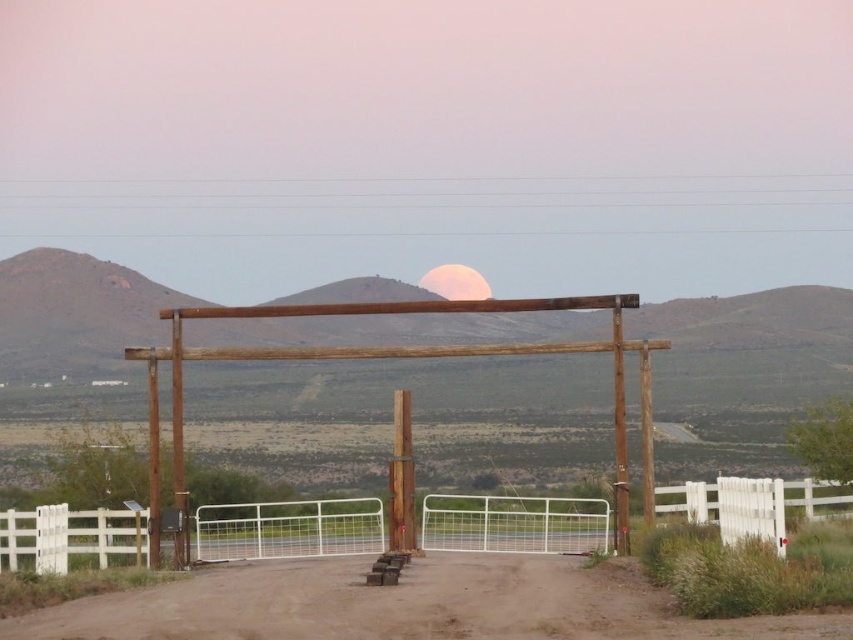
Is dirt track at center smaller than white metal fence at center?

Yes, dirt track at center is smaller than white metal fence at center.

Between dirt track at center and white metal fence at center, which one has less height?

dirt track at center

What do you see at coordinates (408, 605) in the screenshot?
I see `dirt track at center` at bounding box center [408, 605].

You are a GUI agent. You are given a task and a screenshot of the screen. Output one action in this format:
    pyautogui.click(x=<x>, y=<y>)
    Task: Click on the dirt track at center
    This screenshot has width=853, height=640.
    Given the screenshot: What is the action you would take?
    pyautogui.click(x=408, y=605)

Is white metal fence at center taller than brown wooden pergola at center?

No.

Who is shorter, white metal fence at center or brown wooden pergola at center?

white metal fence at center is shorter.

In order to click on white metal fence at center in this screenshot , I will do `click(288, 529)`.

Where is `white metal fence at center`? white metal fence at center is located at coordinates (288, 529).

Is dirt track at center positioned at the back of brown wooden pergola at center?

That is False.

The height and width of the screenshot is (640, 853). What do you see at coordinates (408, 605) in the screenshot?
I see `dirt track at center` at bounding box center [408, 605].

Where is `dirt track at center`? The width and height of the screenshot is (853, 640). dirt track at center is located at coordinates (408, 605).